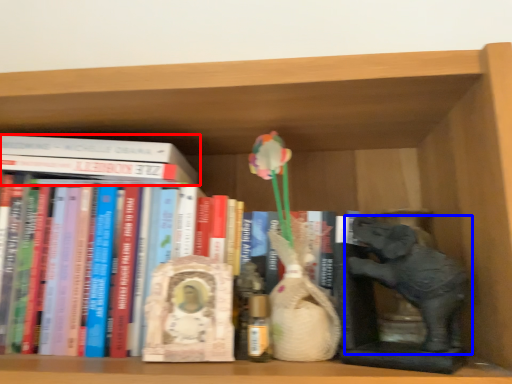
Question: Which object appears farthest to the camera in this image, book (highlighted by a red box) or elephant (highlighted by a blue box)?

Choices:
 (A) book
 (B) elephant

Answer: (A)